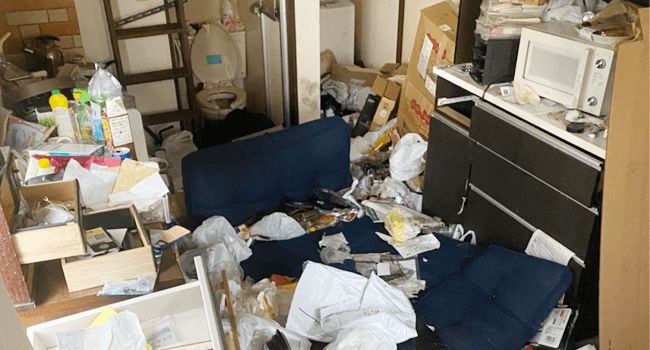
Find the location of a particular element. The width and height of the screenshot is (650, 350). brown dresser drawers is located at coordinates (532, 161), (494, 195), (498, 215), (441, 157).